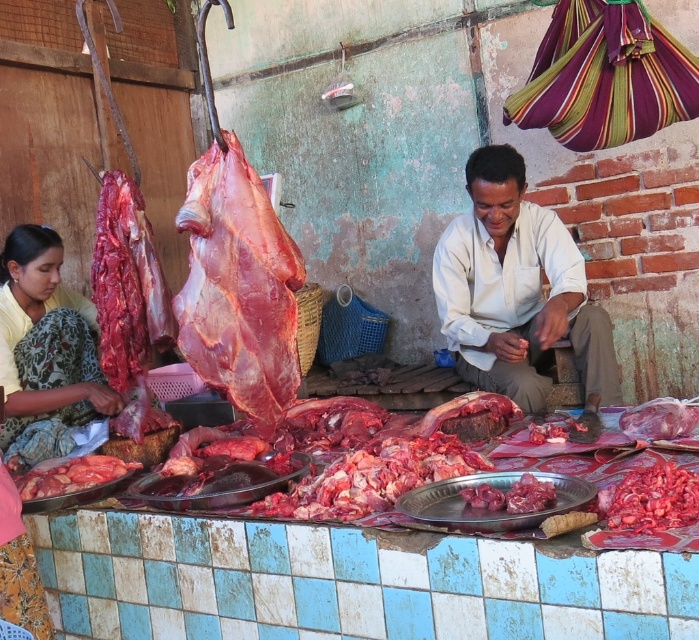
You are a customer at the meat market and want to approach both the white matte shirt at center and the yellow fabric saree at left. Which one should you walk towards first to reach the one closer to you?

You should walk towards the white matte shirt at center first because it is closer to the viewer than the yellow fabric saree at left.

You are a customer at the meat market. You notice two items of clothing in the background. The first is a white matte shirt at center, and the second is a yellow fabric saree at left. Which clothing item is bigger in size?

The white matte shirt at center is larger in size than the yellow fabric saree at left.

You are a customer at the meat market and want to approach both the white matte shirt at center and the yellow fabric saree at left. Based on their positions, which person should you walk towards first if you are standing at the entrance facing the market?

You should approach the yellow fabric saree at left first because the white matte shirt at center is to the right of yellow fabric saree at left, meaning the yellow fabric saree at left is on the left side and closer to your starting position when facing the market.